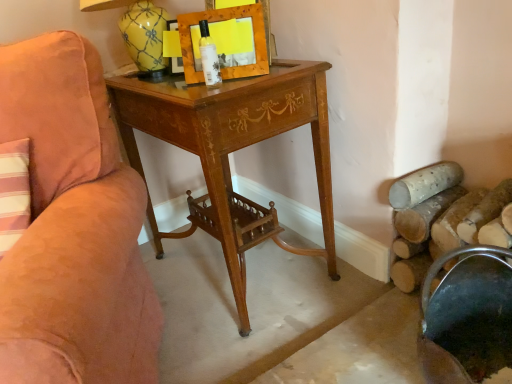
Question: Is metallic dark green bucket at lower right turned away from wooden picture frame at upper center?

Choices:
 (A) yes
 (B) no

Answer: (B)

Question: From a real-world perspective, is metallic dark green bucket at lower right below wooden picture frame at upper center?

Choices:
 (A) no
 (B) yes

Answer: (B)

Question: Is the depth of metallic dark green bucket at lower right greater than that of wooden picture frame at upper center?

Choices:
 (A) yes
 (B) no

Answer: (B)

Question: Is metallic dark green bucket at lower right positioned beyond the bounds of wooden picture frame at upper center?

Choices:
 (A) yes
 (B) no

Answer: (A)

Question: Does metallic dark green bucket at lower right have a greater width compared to wooden picture frame at upper center?

Choices:
 (A) yes
 (B) no

Answer: (A)

Question: Considering the positions of wooden picture frame at upper center and metallic dark green bucket at lower right in the image, is wooden picture frame at upper center taller or shorter than metallic dark green bucket at lower right?

Choices:
 (A) tall
 (B) short

Answer: (B)

Question: Considering the relative positions of wooden picture frame at upper center and metallic dark green bucket at lower right in the image provided, is wooden picture frame at upper center to the left or to the right of metallic dark green bucket at lower right?

Choices:
 (A) left
 (B) right

Answer: (A)

Question: Based on their sizes in the image, would you say wooden picture frame at upper center is bigger or smaller than metallic dark green bucket at lower right?

Choices:
 (A) big
 (B) small

Answer: (B)

Question: Is wooden picture frame at upper center in front of or behind metallic dark green bucket at lower right in the image?

Choices:
 (A) front
 (B) behind

Answer: (B)

Question: Which is correct: wooden desk at center is inside wooden picture frame at upper center, or outside of it?

Choices:
 (A) inside
 (B) outside

Answer: (B)

Question: Considering the positions of wooden desk at center and wooden picture frame at upper center in the image, is wooden desk at center wider or thinner than wooden picture frame at upper center?

Choices:
 (A) wide
 (B) thin

Answer: (A)

Question: Does point (236, 230) appear closer or farther from the camera than point (259, 49)?

Choices:
 (A) closer
 (B) farther

Answer: (B)

Question: Based on their sizes in the image, would you say wooden desk at center is bigger or smaller than wooden picture frame at upper center?

Choices:
 (A) small
 (B) big

Answer: (B)

Question: Considering the positions of point (242, 77) and point (218, 170), is point (242, 77) closer or farther from the camera than point (218, 170)?

Choices:
 (A) closer
 (B) farther

Answer: (B)

Question: Considering their positions, is wooden picture frame at upper center located in front of or behind wooden desk at center?

Choices:
 (A) behind
 (B) front

Answer: (A)